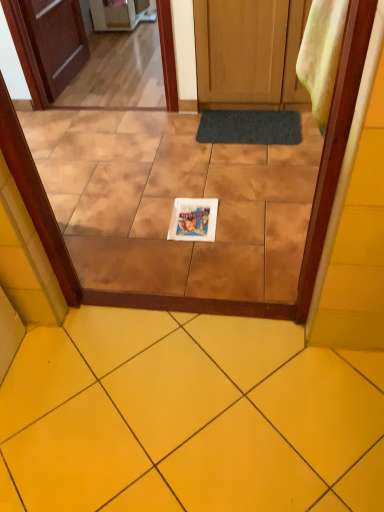
This screenshot has height=512, width=384. I want to click on free spot above dark gray textured mat at center (from a real-world perspective), so click(x=248, y=122).